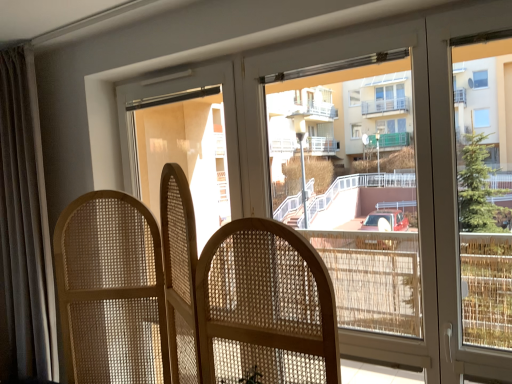
Question: Is natural wood screen at center bigger or smaller than dark gray fabric curtain at left?

Choices:
 (A) big
 (B) small

Answer: (A)

Question: Is natural wood screen at center inside the boundaries of dark gray fabric curtain at left, or outside?

Choices:
 (A) outside
 (B) inside

Answer: (A)

Question: In the image, is natural wood screen at center positioned in front of or behind dark gray fabric curtain at left?

Choices:
 (A) front
 (B) behind

Answer: (A)

Question: Is dark gray fabric curtain at left wider or thinner than natural wood screen at center?

Choices:
 (A) wide
 (B) thin

Answer: (B)

Question: Visually, is dark gray fabric curtain at left positioned to the left or to the right of natural wood screen at center?

Choices:
 (A) right
 (B) left

Answer: (B)

Question: Which is correct: dark gray fabric curtain at left is inside natural wood screen at center, or outside of it?

Choices:
 (A) inside
 (B) outside

Answer: (B)

Question: Based on their sizes in the image, would you say dark gray fabric curtain at left is bigger or smaller than natural wood screen at center?

Choices:
 (A) small
 (B) big

Answer: (A)